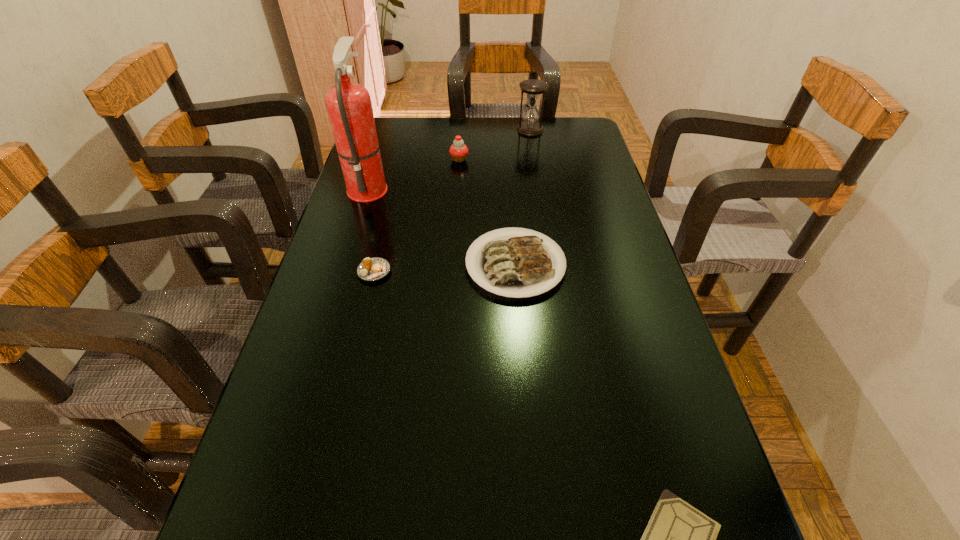
This screenshot has width=960, height=540. Identify the location of free spot located on the left of the second farthest object. (368, 159).

Identify the location of vacant area situated 0.060m on the back of the third shortest object. The image size is (960, 540). (512, 214).

Find the location of a particular element. Image resolution: width=960 pixels, height=540 pixels. free space located on the back of the pastry is located at coordinates (384, 231).

This screenshot has height=540, width=960. Find the location of `object located at the far edge`. object located at the far edge is located at coordinates (533, 89).

Identify the location of fire extinguisher present at the left edge. The height and width of the screenshot is (540, 960). (349, 107).

The image size is (960, 540). In order to click on pastry that is at the left edge in this screenshot , I will do `click(375, 268)`.

Locate an element on the screen. This screenshot has width=960, height=540. vacant space at the far edge is located at coordinates (470, 117).

In the image, there is a desktop. Find the location of `vacant space at the left edge`. vacant space at the left edge is located at coordinates (267, 493).

In the image, there is a desktop. Identify the location of vacant space at the right edge. (580, 180).

You are a GUI agent. You are given a task and a screenshot of the screen. Output one action in this format:
    pyautogui.click(x=<x>, y=<y>)
    Task: Click on the vacant area that lies between the plate and the second shortest object
    The width and height of the screenshot is (960, 540).
    Given the screenshot: What is the action you would take?
    pyautogui.click(x=444, y=268)